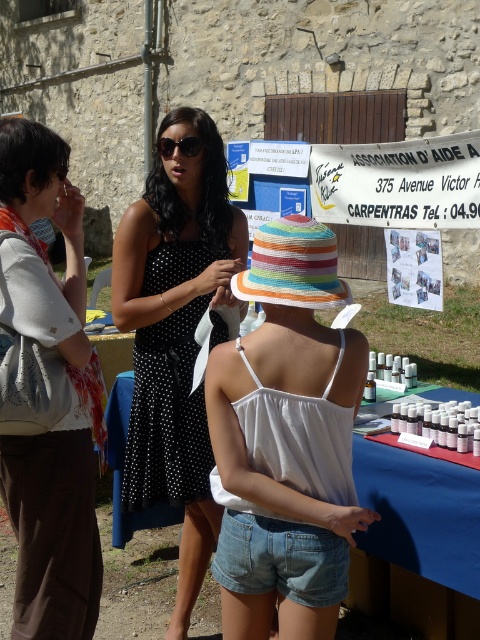
Question: Does white lace top at left have a larger size compared to blue fabric table at center?

Choices:
 (A) yes
 (B) no

Answer: (B)

Question: Which is nearer to the matte black sunglasses at upper center?

Choices:
 (A) blue fabric table at center
 (B) white cotton bikini top at center
 (C) denim shorts at lower center
 (D) black dotted dress at center

Answer: (D)

Question: Among these points, which one is farthest from the camera?

Choices:
 (A) click(344, 529)
 (B) click(158, 150)
 (C) click(154, 561)
 (D) click(269, 540)

Answer: (C)

Question: Is black dotted dress at center below white lace top at left?

Choices:
 (A) no
 (B) yes

Answer: (B)

Question: Does blue fabric table at center appear under matte black sunglasses at upper center?

Choices:
 (A) yes
 (B) no

Answer: (A)

Question: Which point appears farthest from the camera in this image?

Choices:
 (A) (181, 141)
 (B) (159, 592)
 (C) (21, 298)
 (D) (268, 564)

Answer: (B)